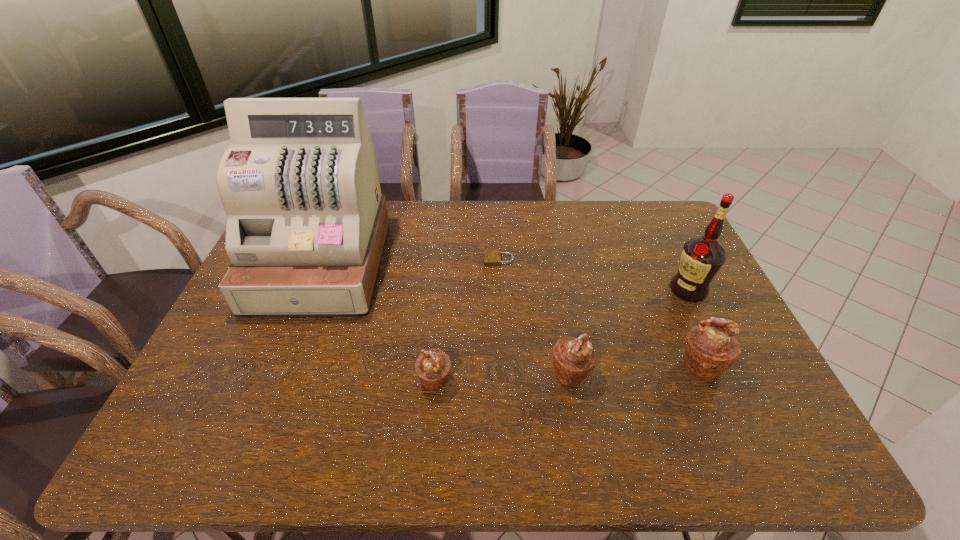
Identify the location of the shortest muffin. (433, 366).

Image resolution: width=960 pixels, height=540 pixels. In order to click on the leftmost muffin in this screenshot , I will do `click(433, 366)`.

You are a GUI agent. You are given a task and a screenshot of the screen. Output one action in this format:
    pyautogui.click(x=<x>, y=<y>)
    Task: Click on the fourth tallest object
    
    Given the screenshot: What is the action you would take?
    pyautogui.click(x=573, y=358)

Where is `the second tallest muffin`? The image size is (960, 540). the second tallest muffin is located at coordinates (573, 358).

Image resolution: width=960 pixels, height=540 pixels. Find the location of `the rightmost muffin`. the rightmost muffin is located at coordinates (711, 349).

Where is `padlock`? padlock is located at coordinates (492, 257).

Find the location of a particular element. the fourth object from right to left is located at coordinates (492, 257).

Locate an element on the screen. The width and height of the screenshot is (960, 540). the tallest object is located at coordinates (306, 227).

At what (x,y) coordinates should I click in order to perform the action: click on cash register. Please return your answer as a coordinate pair (x, y). The width and height of the screenshot is (960, 540). Looking at the image, I should click on (306, 227).

Where is `the fifth shortest object`? The image size is (960, 540). the fifth shortest object is located at coordinates (702, 257).